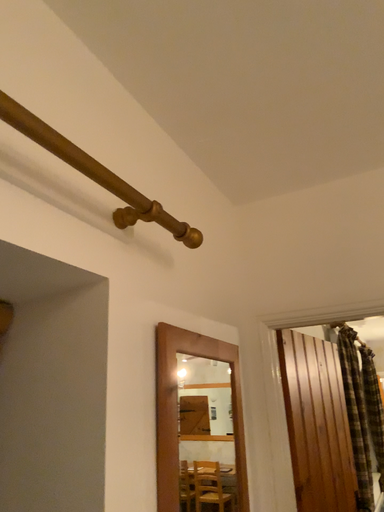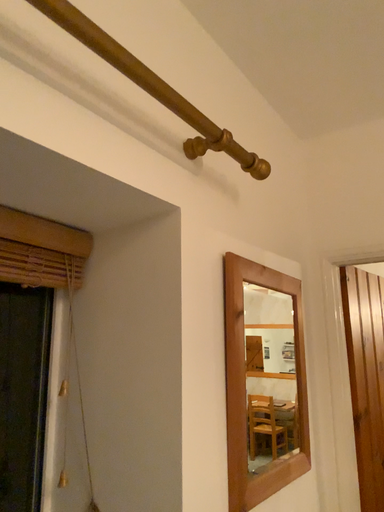
Question: How did the camera likely rotate when shooting the video?

Choices:
 (A) rotated left
 (B) rotated right

Answer: (A)